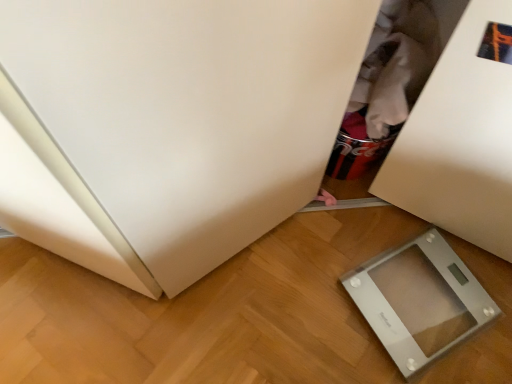
Identify the location of vacant space situated on the left part of transparent glass scale at lower right. Image resolution: width=512 pixels, height=384 pixels. (312, 295).